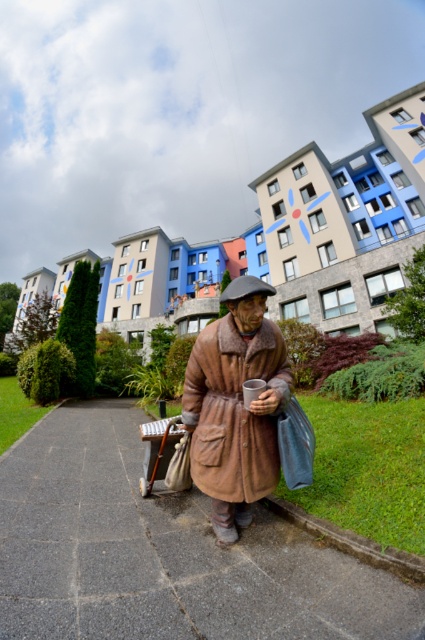
You are a delivery person who needs to place a small package on the smooth concrete pavement at center. However, there is a brown woolen coat at center already on it. Can the package be placed there without moving the coat?

The smooth concrete pavement at center has a smaller size compared to brown woolen coat at center, so the package cannot be placed there without moving the coat.

You are a delivery person who needs to place a package on the smooth concrete pavement at center without it touching the brown woolen coat at center. Is there enough space between them?

The smooth concrete pavement at center is wider than the brown woolen coat at center, so yes, there is enough space to place the package without it touching the coat.

Consider the image. You are a delivery person trying to reach the gray concrete curb at lower center. You are currently standing near the brown woolen coat at center. Which direction should you move to get closer to the curb?

Since the brown woolen coat at center is closer to you than the gray concrete curb at lower center, you should move forward in the direction away from the coat to reach the curb.